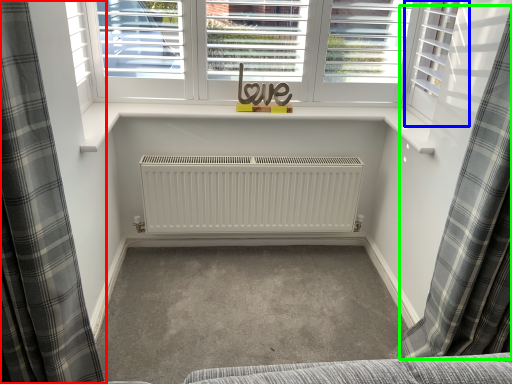
Question: Considering the real-world distances, which object is closest to curtain (highlighted by a red box)? shutter (highlighted by a blue box) or curtain (highlighted by a green box).

Choices:
 (A) shutter
 (B) curtain

Answer: (B)